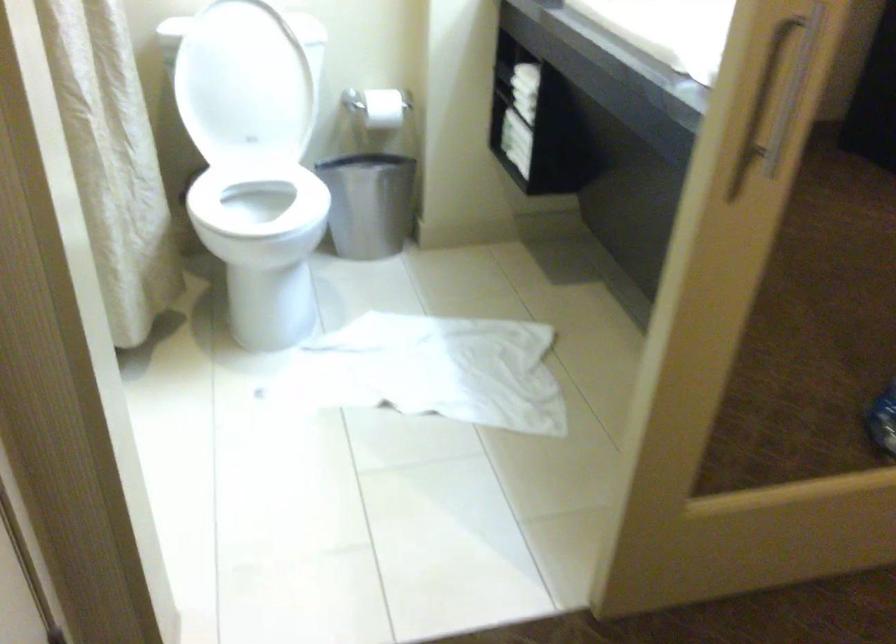
Find where to lift the white toilet seat. Please return your answer as a coordinate pair (x, y).

(259, 210)